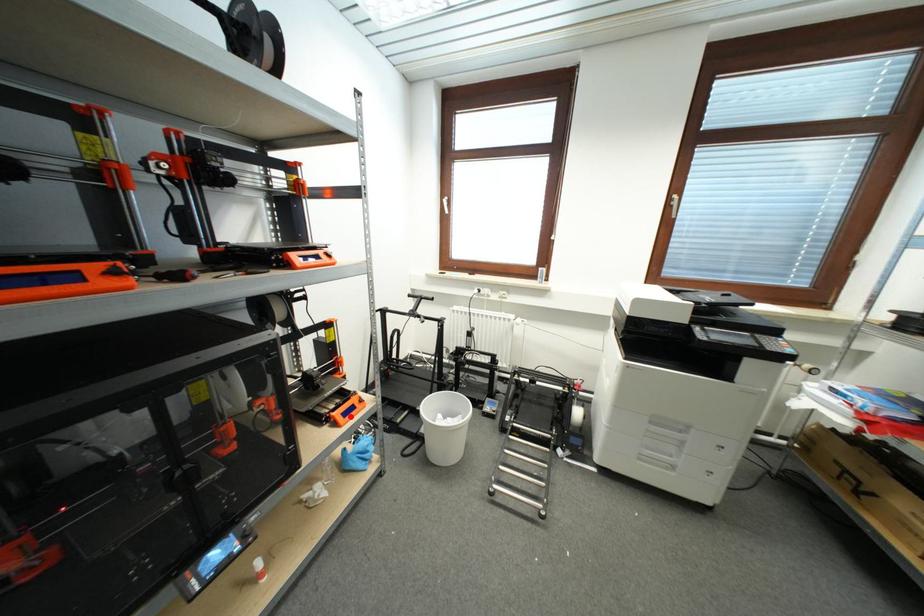
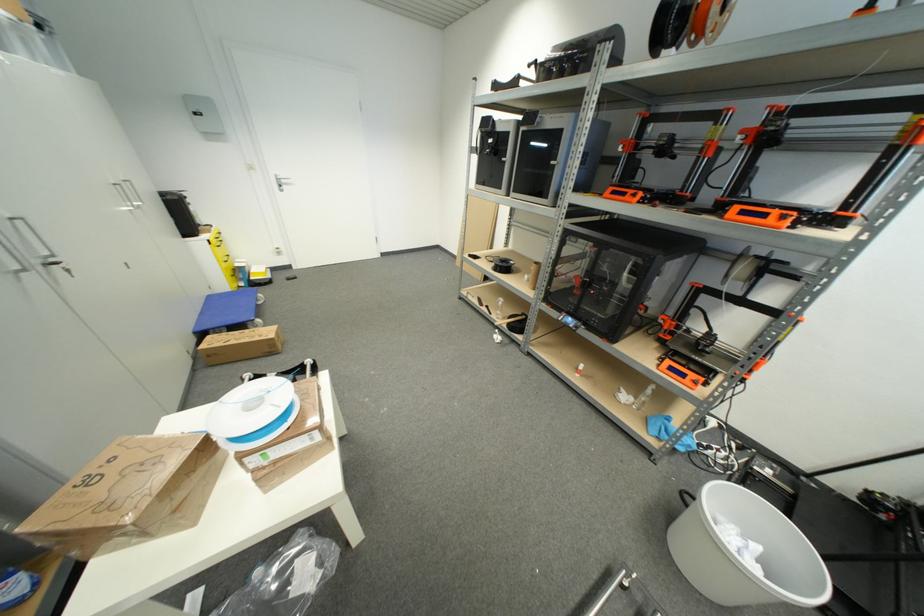
Locate, in the second image, the point that corresponds to the highlighted location in the first image.

(675, 371)